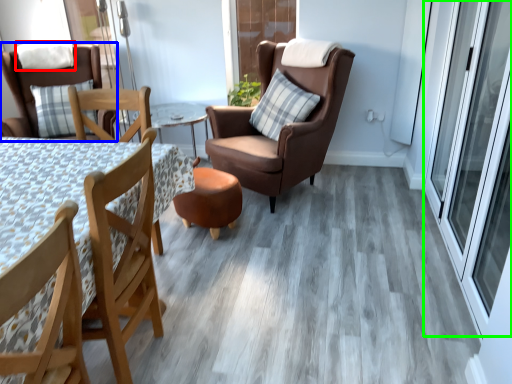
Question: Based on their relative distances, which object is farther from pillow (highlighted by a red box)? Choose from chair (highlighted by a blue box) and screen door (highlighted by a green box).

Choices:
 (A) chair
 (B) screen door

Answer: (B)